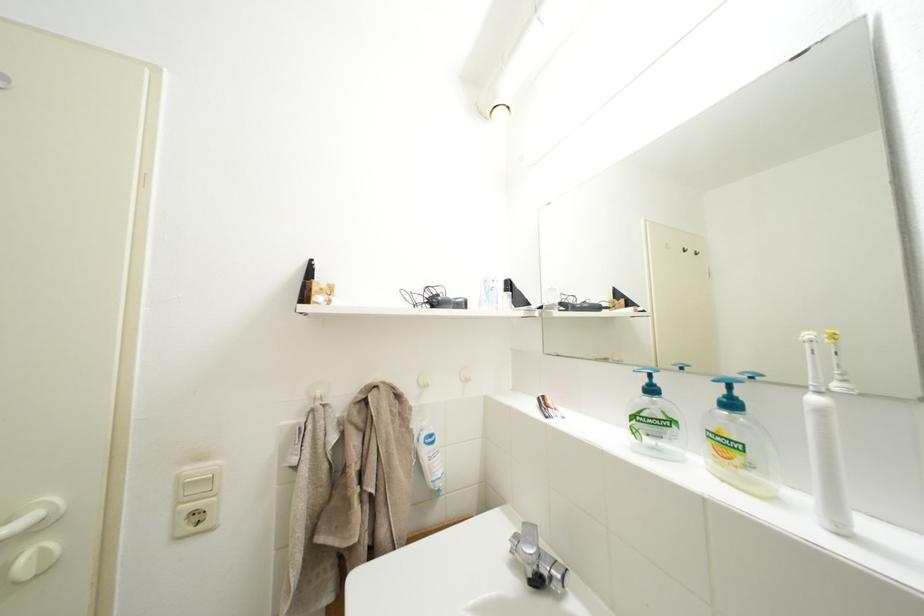
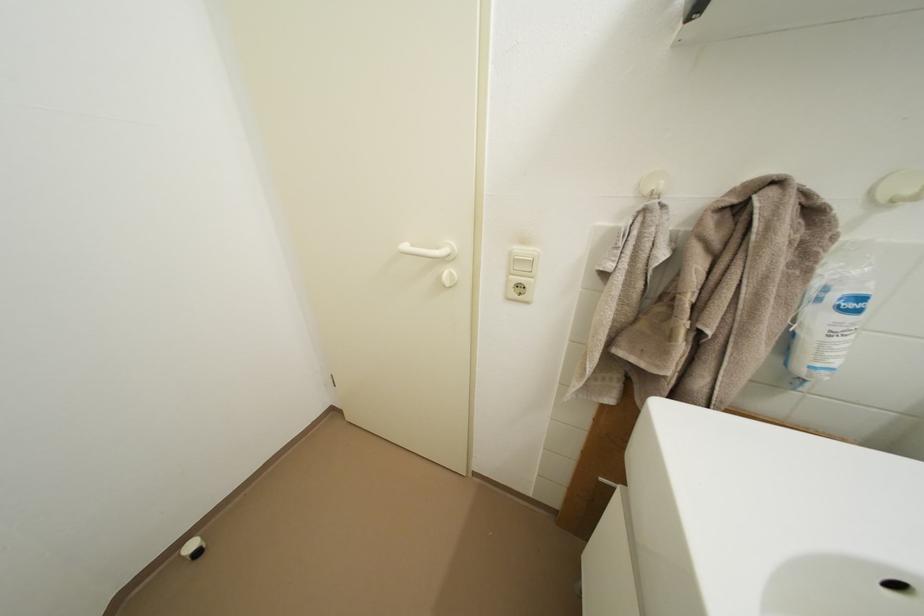
How did the camera likely rotate?

The camera rotated toward left-down.